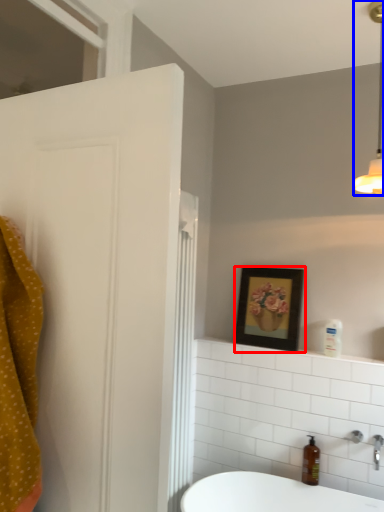
Question: Which object is further to the camera taking this photo, picture frame (highlighted by a red box) or light fixture (highlighted by a blue box)?

Choices:
 (A) picture frame
 (B) light fixture

Answer: (A)